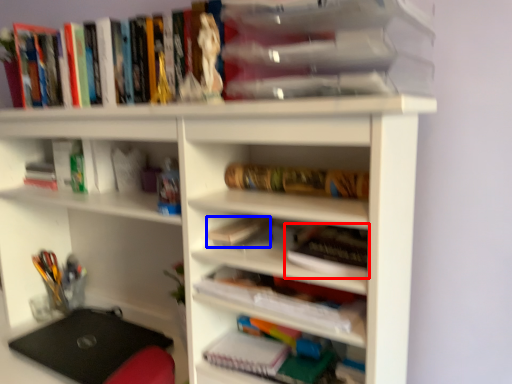
Question: Which of the following is the farthest to the observer, book (highlighted by a red box) or book (highlighted by a blue box)?

Choices:
 (A) book
 (B) book

Answer: (B)